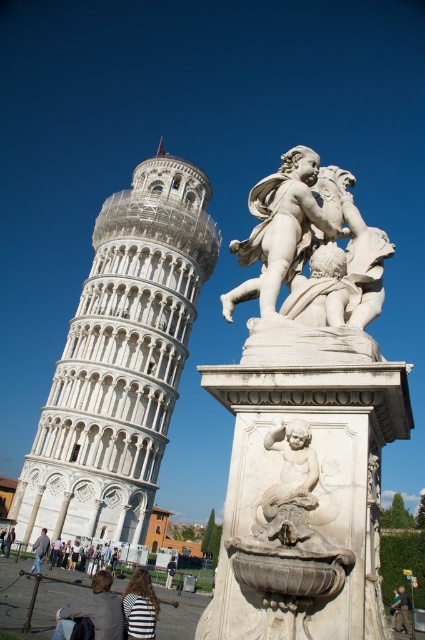
Question: Which of the following is the closest to the observer?

Choices:
 (A) (91, 618)
 (B) (170, 557)

Answer: (A)

Question: Which of these objects is positioned closest to the light brown leather jacket at lower left?

Choices:
 (A) light brown leather jacket at lower center
 (B) white marble cherub at center
 (C) striped fabric at lower center

Answer: (A)

Question: Is white marble statue at right bigger than light brown leather jacket at lower left?

Choices:
 (A) no
 (B) yes

Answer: (B)

Question: Which point is closer to the camera?

Choices:
 (A) white marble statue at right
 (B) white marble tower at left
 (C) striped fabric at lower center
 (D) white marble cherub at center

Answer: (D)

Question: Does white marble cherub at center appear over light brown leather jacket at lower center?

Choices:
 (A) yes
 (B) no

Answer: (A)

Question: Is dark gray fabric jacket at lower right thinner than light brown leather jacket at lower left?

Choices:
 (A) yes
 (B) no

Answer: (A)